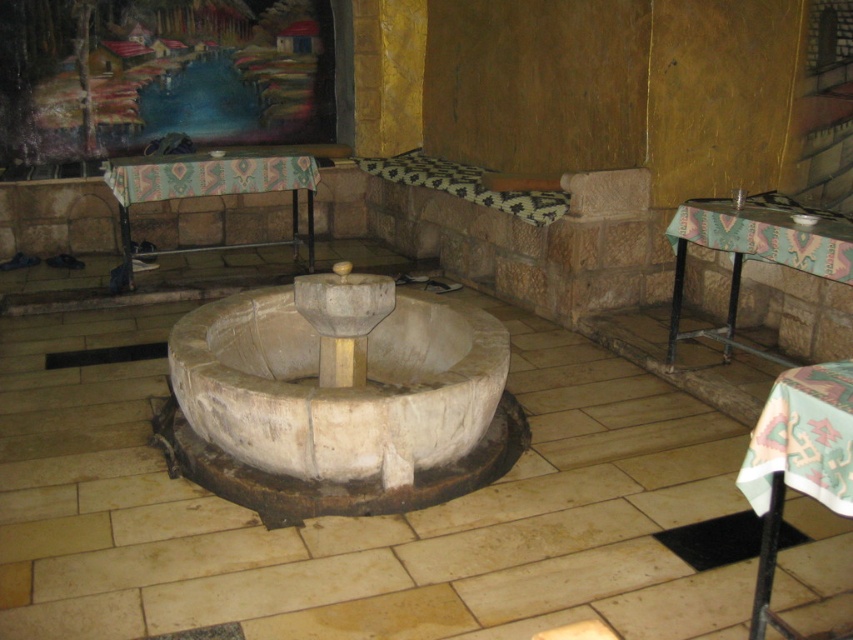
You are standing at the entrance of the communal space and want to place a new plant stand exactly where the textured fabric table at center is currently located. According to the coordinates provided, what are the coordinates of the point where you should place the plant stand?

The coordinates for the textured fabric table at center are at point (752, 256). Therefore, you should place the plant stand at coordinates (752, 256).